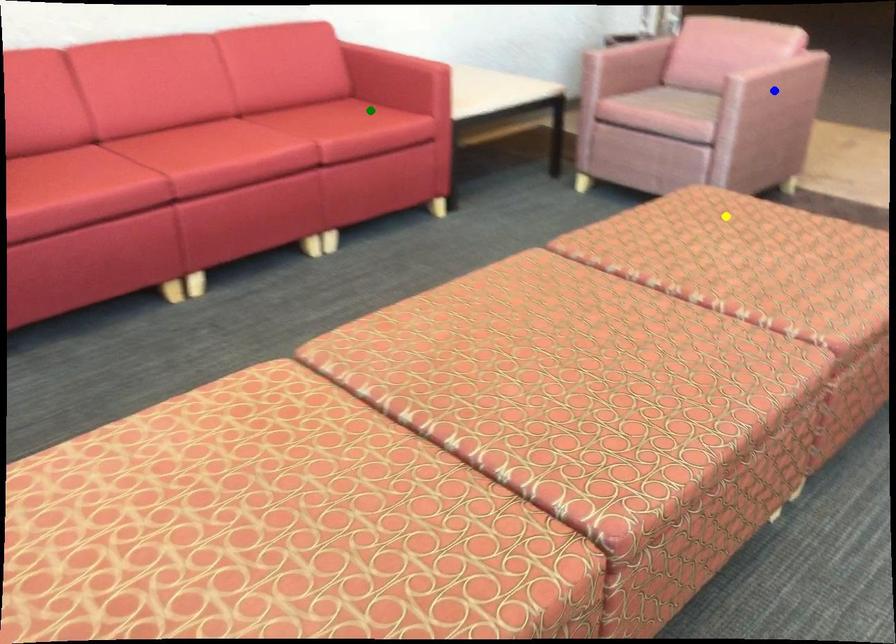
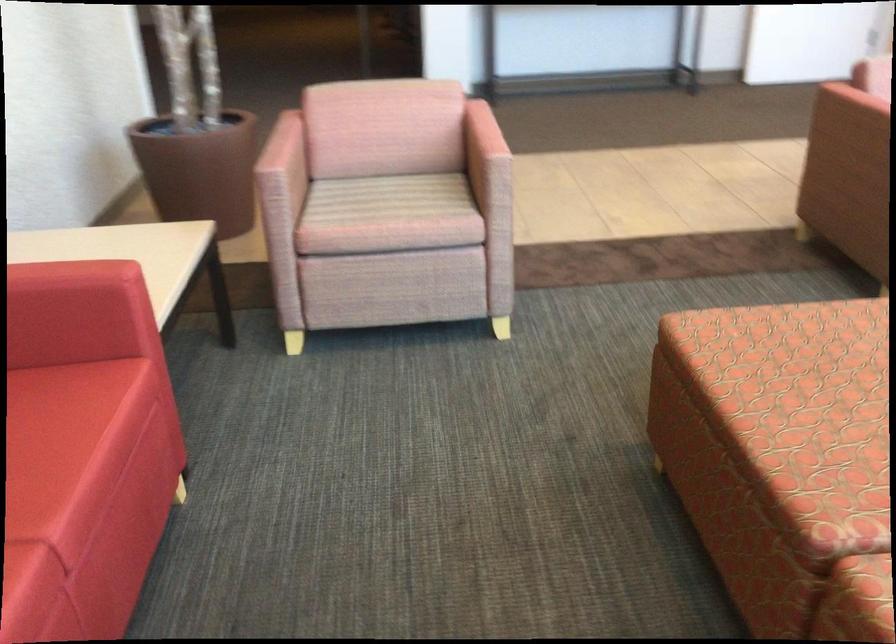
I am providing you with two images of the same scene from different viewpoints. Three points are marked in image1. Which point corresponds to a part or object that is occluded in image2?In image1, three points are marked. Which of them correspond to a part or object that is occluded in image2?Among the three points shown in image1, which one corresponds to a part or object that is no longer visible due to occlusion in image2?

blue point cannot be seen in image2.